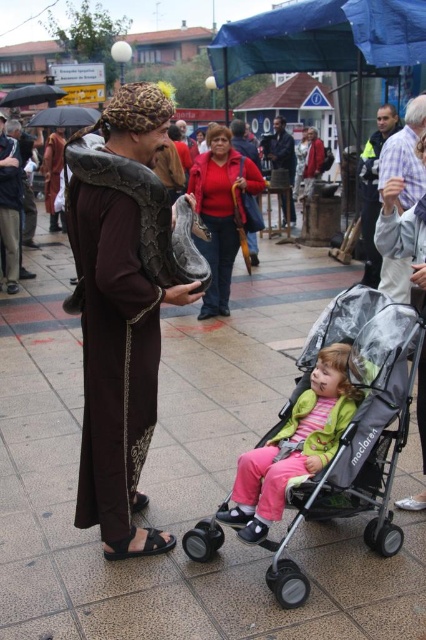
You are a photographer at the event and want to capture both the matte brown robe at center and the pastel green fabric baby at lower center in the same frame. Based on their sizes, which object should you focus on first to ensure both are in focus?

The matte brown robe at center is taller than the pastel green fabric baby at lower center, so focusing on the matte brown robe at center first would help ensure both are in focus since it is the larger object.

Consider the image. You are a parent at the event and need to check on your child in the gray fabric baby carriage at lower center. You are currently standing near the matte red sweater at center. Which direction should you move to reach the baby carriage?

You should move to the right to reach the gray fabric baby carriage at lower center because it is located to the right of the matte red sweater at center.